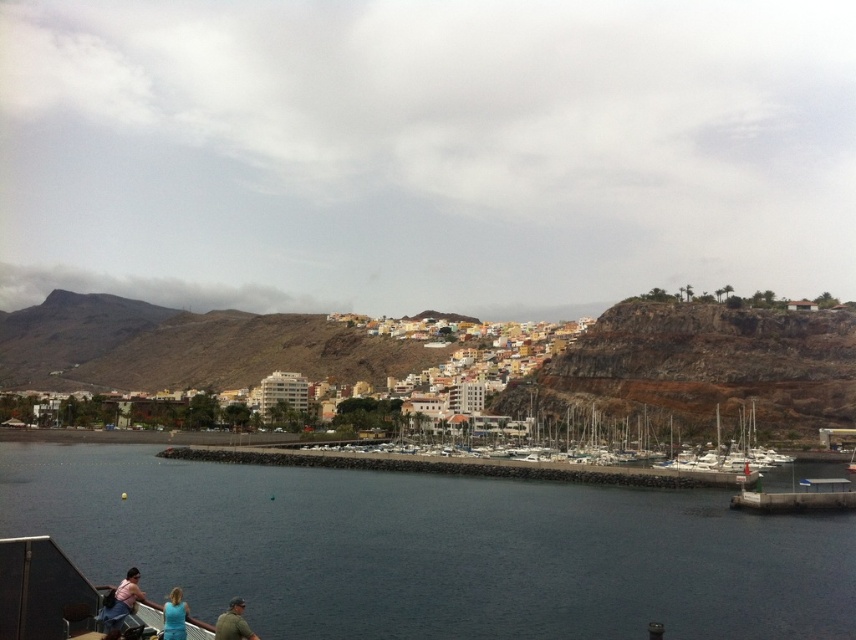
Question: Which object is farther from the camera taking this photo?

Choices:
 (A) white matte boats at center
 (B) blue fabric shirt at lower left
 (C) dark blue water at center

Answer: (A)

Question: Can you confirm if white matte boats at center is bigger than blue fabric shirt at lower left?

Choices:
 (A) yes
 (B) no

Answer: (A)

Question: Which point is farther to the camera?

Choices:
 (A) brown rocky hillside at upper center
 (B) matte pink shirt at lower left

Answer: (A)

Question: Considering the real-world distances, which object is closest to the dark blue water at center?

Choices:
 (A) blue fabric shirt at lower left
 (B) matte pink shirt at lower left
 (C) brown rocky hillside at upper center
 (D) white matte boats at center

Answer: (D)

Question: Does matte pink shirt at lower left have a smaller size compared to blue fabric shirt at lower left?

Choices:
 (A) yes
 (B) no

Answer: (B)

Question: From the image, what is the correct spatial relationship of dark blue water at center in relation to blue fabric shirt at lower left?

Choices:
 (A) below
 (B) above

Answer: (A)